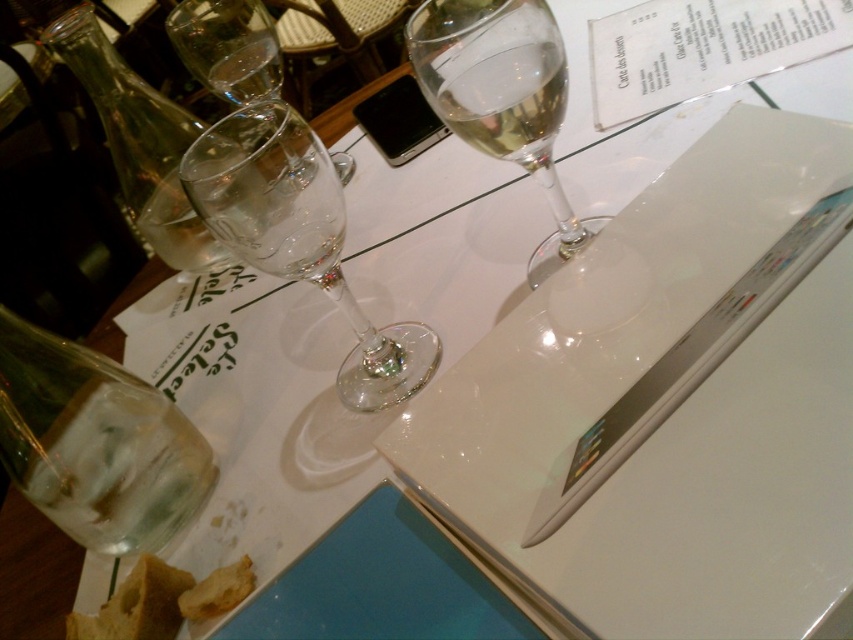
Is transparent glass bottle at lower left taller than clear glass wine glass at center?

No, transparent glass bottle at lower left is not taller than clear glass wine glass at center.

Is transparent glass bottle at lower left positioned before clear glass wine glass at center?

No, transparent glass bottle at lower left is behind clear glass wine glass at center.

The width and height of the screenshot is (853, 640). What do you see at coordinates (96, 444) in the screenshot?
I see `transparent glass bottle at lower left` at bounding box center [96, 444].

Where is `transparent glass bottle at lower left`? The height and width of the screenshot is (640, 853). transparent glass bottle at lower left is located at coordinates (96, 444).

Can you confirm if transparent glass bottle at lower left is shorter than transparent glass wine glass at center?

Yes, transparent glass bottle at lower left is shorter than transparent glass wine glass at center.

Can you confirm if transparent glass bottle at lower left is smaller than transparent glass wine glass at center?

Yes, transparent glass bottle at lower left is smaller than transparent glass wine glass at center.

Between point (16, 419) and point (277, 230), which one is positioned behind?

The point (16, 419) is more distant.

Locate an element on the screen. The width and height of the screenshot is (853, 640). transparent glass bottle at lower left is located at coordinates (96, 444).

Does transparent glass bottle at lower left come in front of clear glass wine at upper center?

No.

Is transparent glass bottle at lower left smaller than clear glass wine at upper center?

Incorrect, transparent glass bottle at lower left is not smaller in size than clear glass wine at upper center.

Identify the location of transparent glass bottle at lower left. (96, 444).

This screenshot has width=853, height=640. Identify the location of transparent glass bottle at lower left. (96, 444).